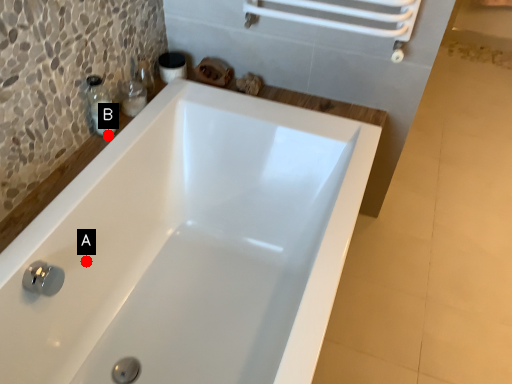
Question: Two points are circled on the image, labeled by A and B beside each circle. Which point is closer to the camera taking this photo?

Choices:
 (A) A is closer
 (B) B is closer

Answer: (A)